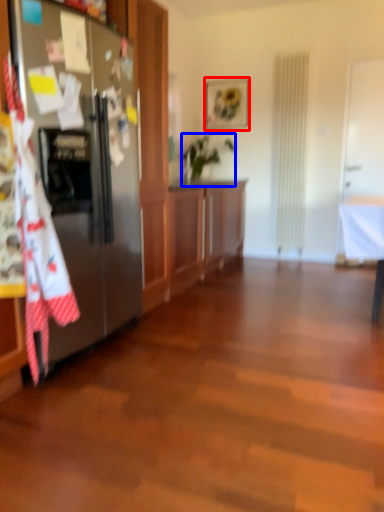
Question: Which of the following is the closest to the observer, picture frame (highlighted by a red box) or houseplant (highlighted by a blue box)?

Choices:
 (A) picture frame
 (B) houseplant

Answer: (B)